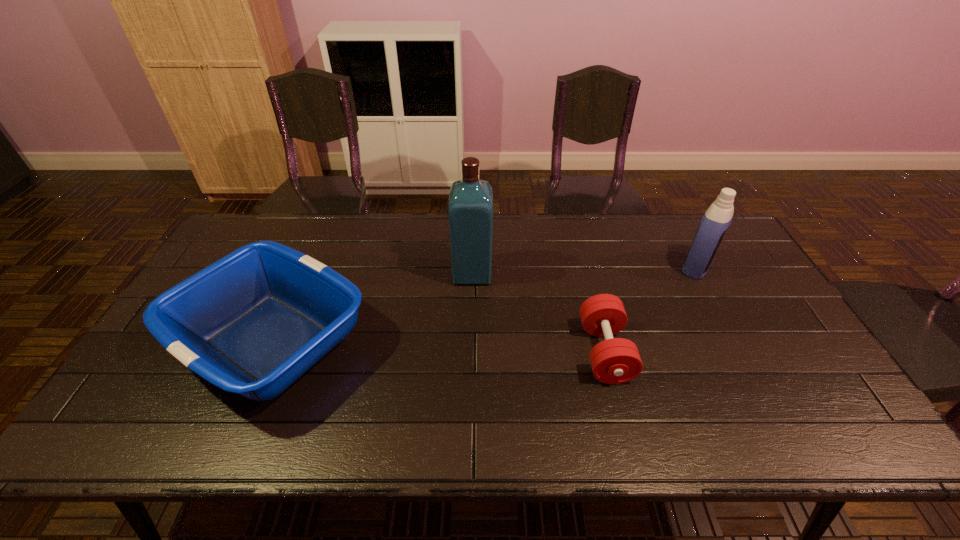
Locate an element on the screen. Image resolution: width=960 pixels, height=540 pixels. blank space located on the right of the third tallest object is located at coordinates (407, 342).

The image size is (960, 540). I want to click on free space located 0.220m on the left of the third object from left to right, so click(499, 352).

Where is `object located at the far edge`? This screenshot has height=540, width=960. object located at the far edge is located at coordinates (718, 217).

Find the location of a particular element. The image size is (960, 540). object that is at the near edge is located at coordinates (253, 322).

Identify the location of object present at the left edge. (253, 322).

Locate an element on the screen. object present at the right edge is located at coordinates (718, 217).

Where is `object located at the near left corner`? object located at the near left corner is located at coordinates (253, 322).

Locate an element on the screen. object that is at the far right corner is located at coordinates (718, 217).

Where is `vacant space at the far edge`? vacant space at the far edge is located at coordinates (x=582, y=221).

The height and width of the screenshot is (540, 960). Find the location of `free space at the near edge of the desktop`. free space at the near edge of the desktop is located at coordinates (682, 426).